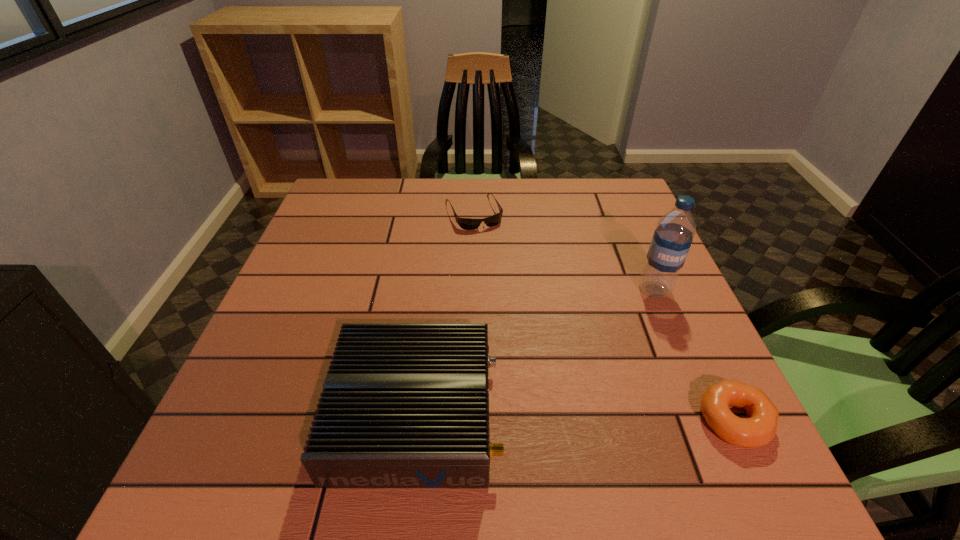
Identify the location of free spot between the router and the second farthest object. (535, 352).

This screenshot has height=540, width=960. In order to click on empty space that is in between the third nearest object and the doughnut in this screenshot , I will do `click(694, 355)`.

Where is `vacant point located between the router and the second farthest object`? vacant point located between the router and the second farthest object is located at coordinates (535, 352).

You are a GUI agent. You are given a task and a screenshot of the screen. Output one action in this format:
    pyautogui.click(x=<x>, y=<y>)
    Task: Click on the empty location between the farthest object and the router
    
    Given the screenshot: What is the action you would take?
    pyautogui.click(x=444, y=313)

What are the coordinates of `free area in between the second farthest object and the third tallest object` in the screenshot? It's located at (694, 355).

The image size is (960, 540). I want to click on object that stands as the closest to the shortest object, so click(x=673, y=236).

Select which object is the second closest to the second shortest object. Please provide its 2D coordinates. Your answer should be formatted as a tuple, i.e. [(x, y)], where the tuple contains the x and y coordinates of a point satisfying the conditions above.

[(404, 405)]

This screenshot has height=540, width=960. In order to click on vacant space that satisfies the following two spatial constraints: 1. on the front side of the second shortest object; 2. on the right side of the shortest object in this screenshot , I will do `click(469, 420)`.